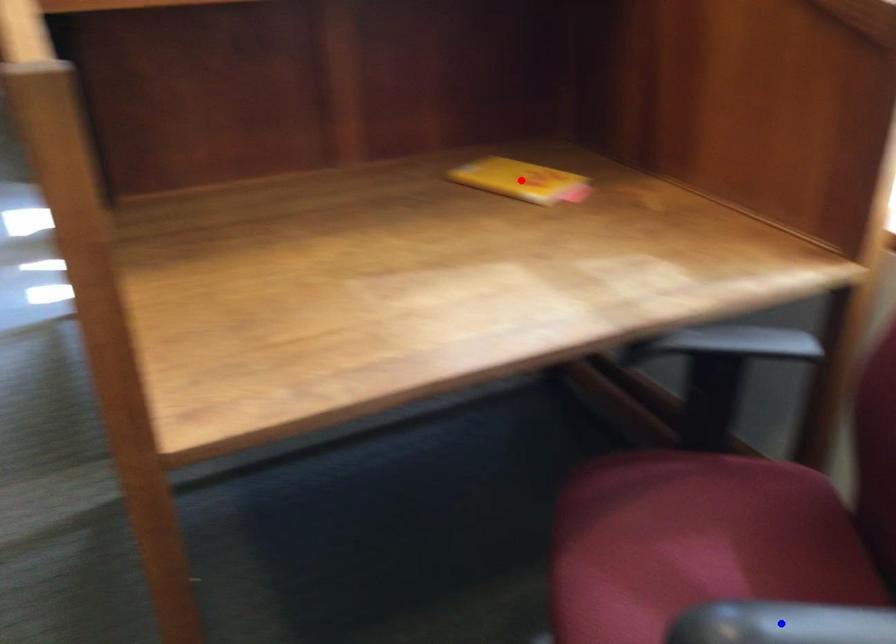
Question: Two points are marked on the image. Which point is closer to the camera?

Choices:
 (A) Blue point is closer.
 (B) Red point is closer.

Answer: (A)